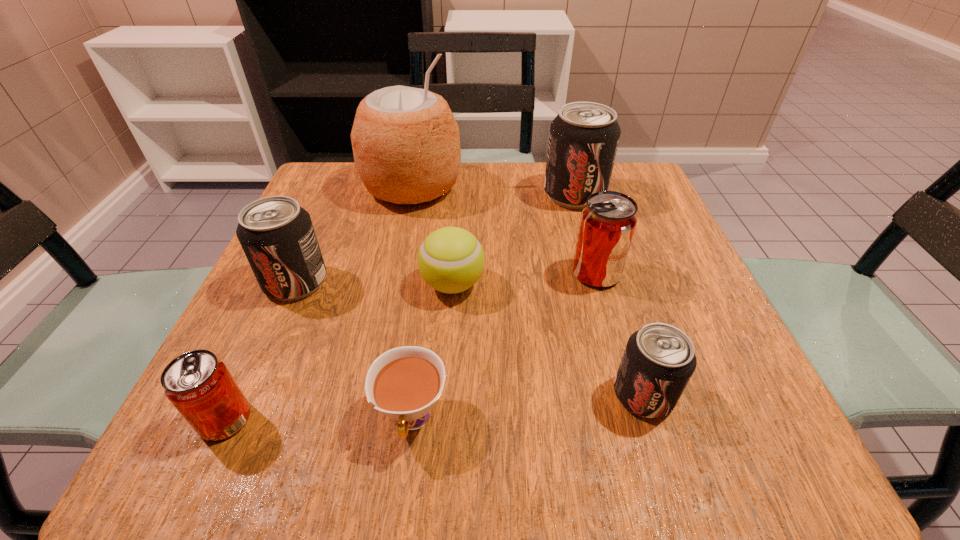
Where is `coconut that is positioned at the far edge`? The image size is (960, 540). coconut that is positioned at the far edge is located at coordinates click(x=406, y=145).

Identify the location of soda can that is at the far edge. (584, 136).

At what (x,y) coordinates should I click in order to perform the action: click on teacup situated at the near edge. Please return your answer as a coordinate pair (x, y). Looking at the image, I should click on (405, 382).

Locate an element on the screen. Image resolution: width=960 pixels, height=540 pixels. coconut present at the left edge is located at coordinates (406, 145).

Find the location of a particular element. This screenshot has height=540, width=960. object that is at the far left corner is located at coordinates (406, 145).

At what (x,y) coordinates should I click in order to perform the action: click on object present at the near left corner. Please return your answer as a coordinate pair (x, y). Looking at the image, I should click on (199, 385).

This screenshot has height=540, width=960. I want to click on object that is at the far right corner, so click(584, 136).

Locate an element on the screen. The image size is (960, 540). object present at the near right corner is located at coordinates (659, 359).

Where is `vacant space at the far edge of the desktop`? vacant space at the far edge of the desktop is located at coordinates (511, 174).

In the image, there is a desktop. Identify the location of free space at the near edge. The width and height of the screenshot is (960, 540). (458, 441).